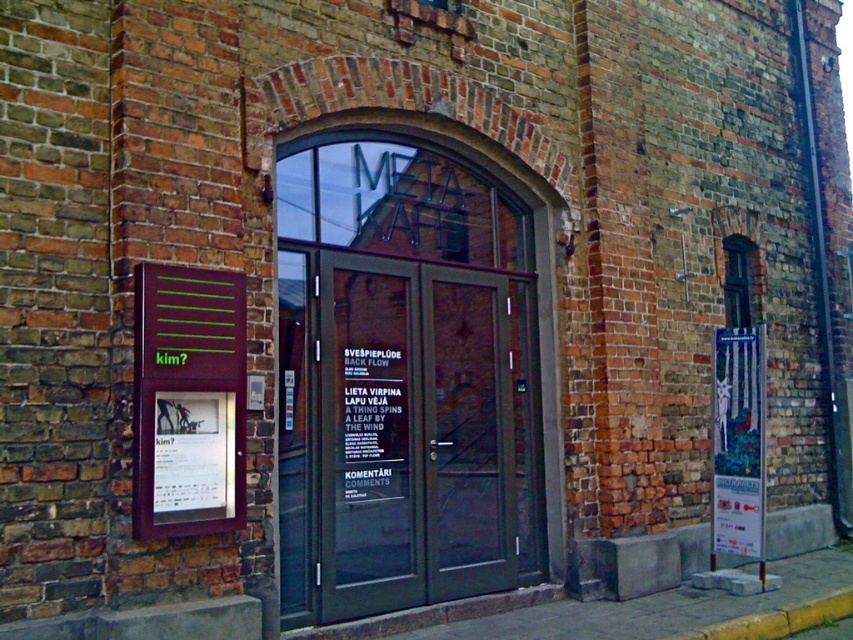
At what (x,y) coordinates should I click in order to perform the action: click on matte purple signboard at left. Please return your answer as a coordinate pair (x, y). Looking at the image, I should click on (189, 401).

Is matte purple signboard at left taller than metallic poster at right?

No.

In order to click on matte purple signboard at left in this screenshot , I will do `click(189, 401)`.

Find the location of a particular element. This screenshot has height=640, width=853. green glass doors at center is located at coordinates (403, 380).

How much distance is there between green glass doors at center and metallic poster at right?

They are 2.10 meters apart.

Measure the distance between green glass doors at center and camera.

They are 5.04 meters apart.

At what (x,y) coordinates should I click in order to perform the action: click on green glass doors at center. Please return your answer as a coordinate pair (x, y). Looking at the image, I should click on (403, 380).

Is green glass door at center wider than matte purple signboard at left?

Indeed, green glass door at center has a greater width compared to matte purple signboard at left.

Who is more distant from viewer, (376, 433) or (142, 323)?

The point (376, 433) is more distant.

I want to click on green glass door at center, so click(x=372, y=435).